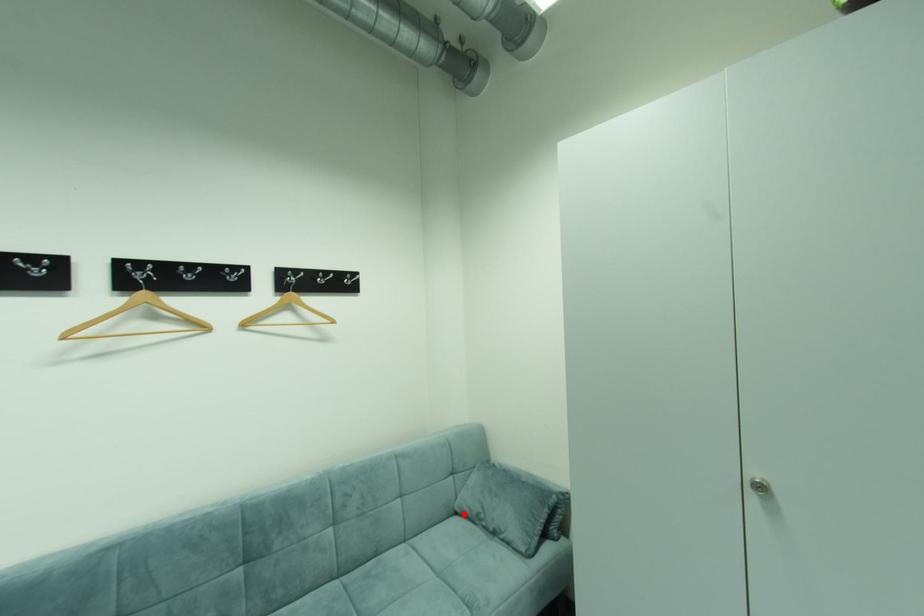
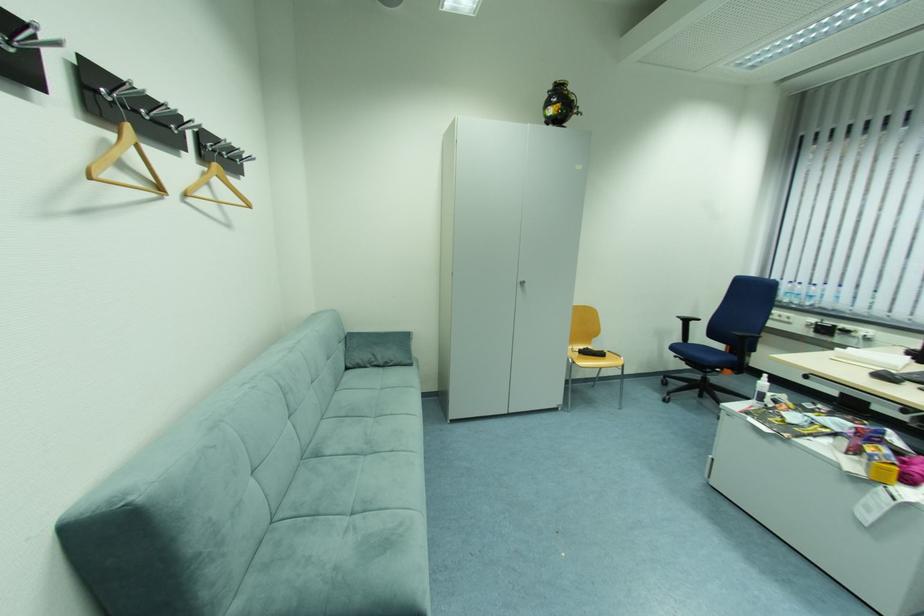
Find the pixel in the second image that matches the highlighted location in the first image.

(354, 370)